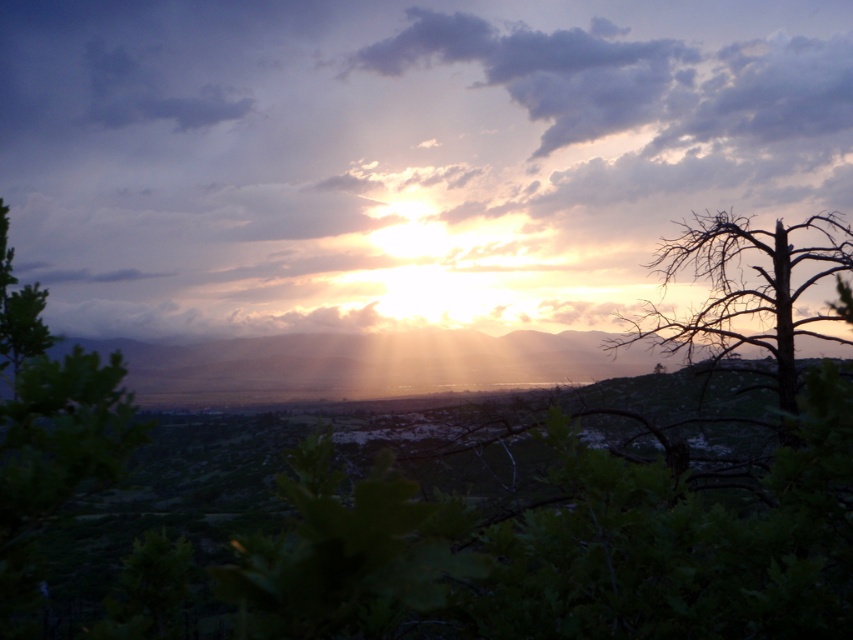
Is green leafy tree at left above brown/dry wood tree at right?

Yes.

The width and height of the screenshot is (853, 640). Describe the element at coordinates (51, 412) in the screenshot. I see `green leafy tree at left` at that location.

Does point (91, 390) lie in front of point (714, 324)?

That is True.

Where is `green leafy tree at left`? The height and width of the screenshot is (640, 853). green leafy tree at left is located at coordinates (51, 412).

Who is positioned more to the left, cloudy at upper center or brown/dry wood tree at right?

cloudy at upper center

Is cloudy at upper center below brown/dry wood tree at right?

Actually, cloudy at upper center is above brown/dry wood tree at right.

Locate an element on the screen. This screenshot has width=853, height=640. cloudy at upper center is located at coordinates (399, 154).

The height and width of the screenshot is (640, 853). What do you see at coordinates (399, 154) in the screenshot?
I see `cloudy at upper center` at bounding box center [399, 154].

Between cloudy at upper center and green leafy tree at left, which one appears on the right side from the viewer's perspective?

Positioned to the right is cloudy at upper center.

Locate an element on the screen. cloudy at upper center is located at coordinates (399, 154).

I want to click on cloudy at upper center, so click(x=399, y=154).